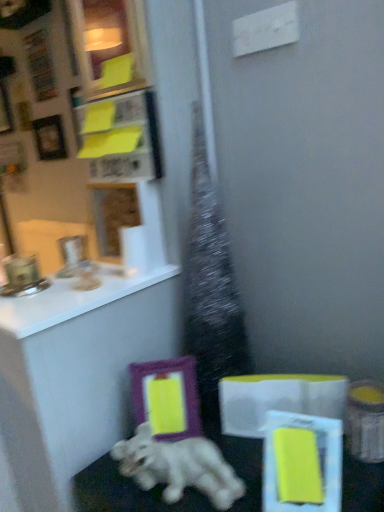
Where is `vacant region above white glossy countertop at upper left (from a real-world perspective)`? The image size is (384, 512). vacant region above white glossy countertop at upper left (from a real-world perspective) is located at coordinates (58, 285).